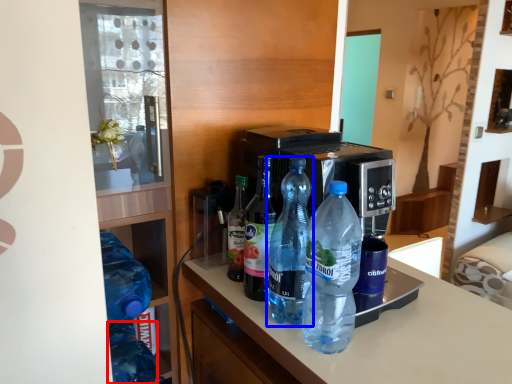
Question: Which object appears farthest to the camera in this image, bottle (highlighted by a red box) or bottle (highlighted by a blue box)?

Choices:
 (A) bottle
 (B) bottle

Answer: (A)